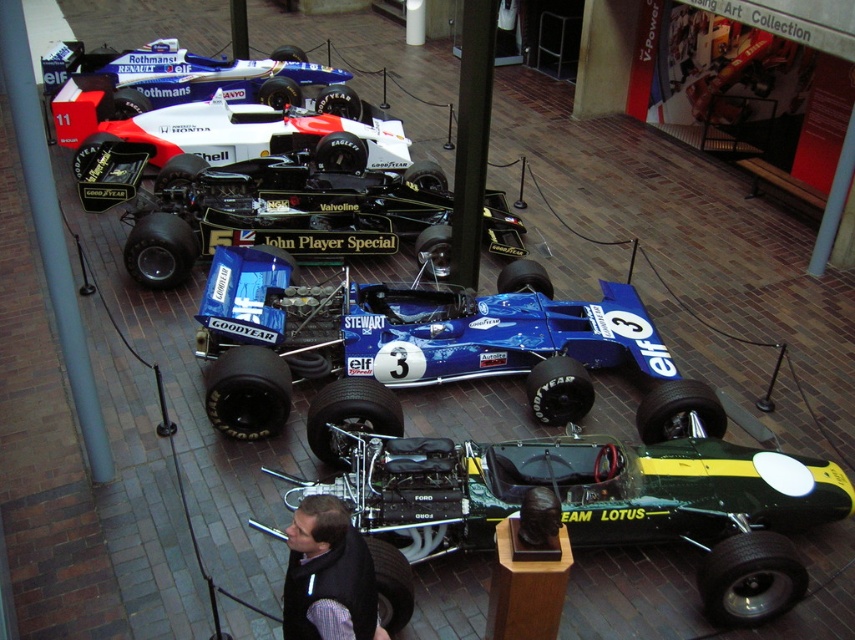
You are a visitor standing in front of the Formula One car exhibition. You notice two points marked in the image at coordinates point [753,490] and point [578,385]. Which point is nearer to your current position?

Point [753,490] is closer to the viewer than point [578,385], so the first point is nearer to your current position.

You are a tour guide explaining the exhibition layout to visitors. You want to point out the green metallic race car at center and the blue glossy race car at center. Which one would you mention first if you want to follow the correct viewing order from front to back?

The green metallic race car at center should be mentioned first as it is closer to the viewer compared to the blue glossy race car at center, following the front to back viewing order.

You are a tour guide giving a tour of the Formula One car exhibition. You want to point out the blue glossy race car at center to your visitors. Which car should you indicate relative to the black glossy race car at center?

The blue glossy race car at center is positioned on the right side of the black glossy race car at center, so you should indicate the car to the right of the black one.